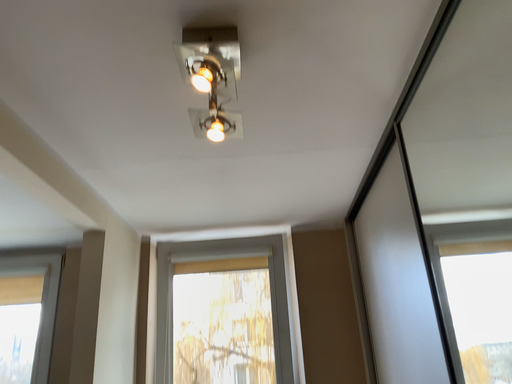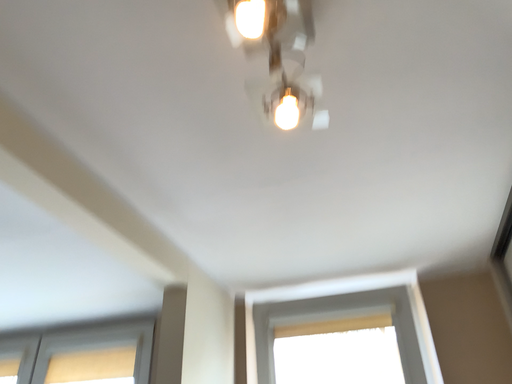
Question: Which way did the camera rotate in the video?

Choices:
 (A) rotated upward
 (B) rotated downward

Answer: (A)